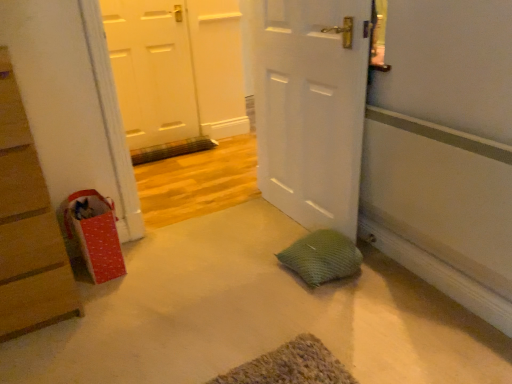
Where is `vacant space underneath wooden vent at center (from a real-world perspective)`? The height and width of the screenshot is (384, 512). vacant space underneath wooden vent at center (from a real-world perspective) is located at coordinates (178, 159).